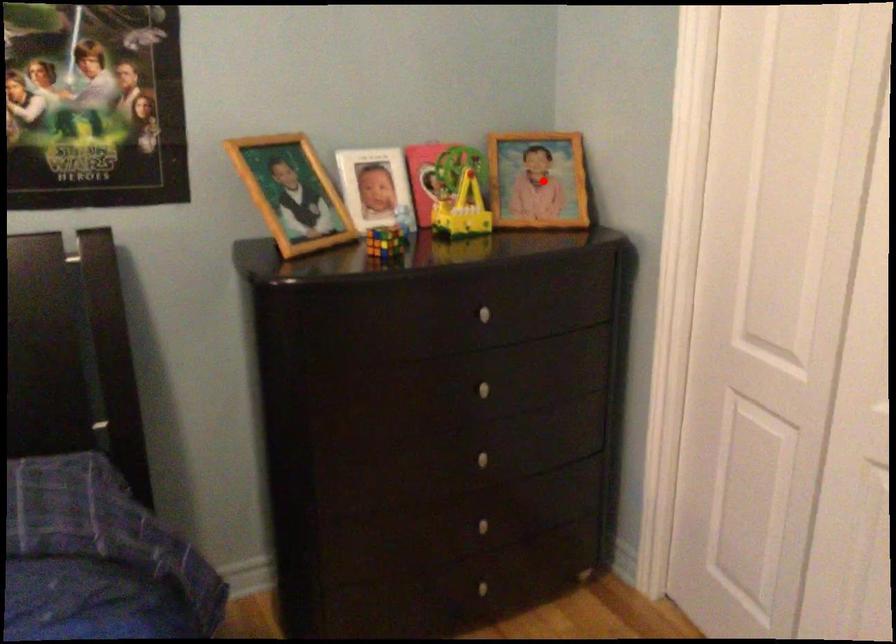
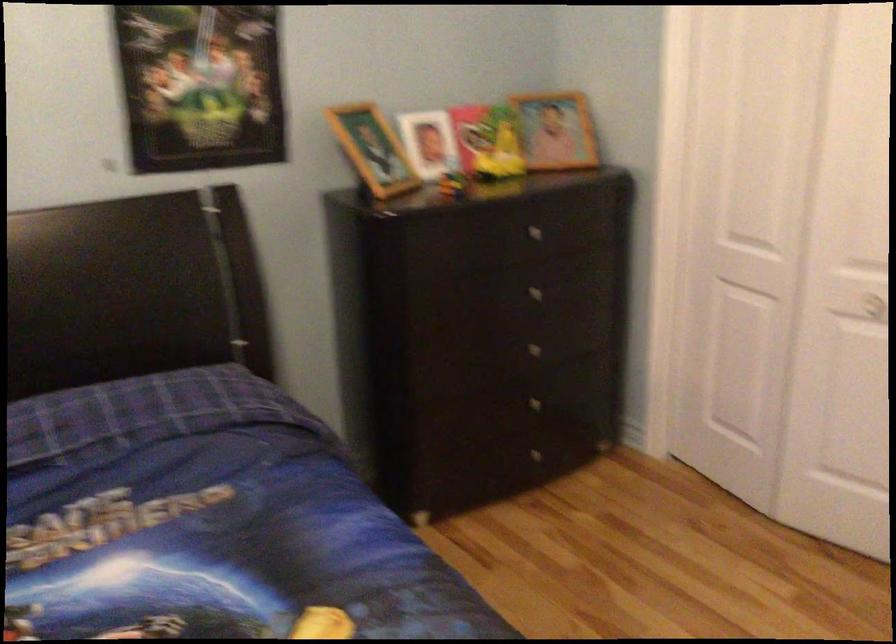
In the second image, find the point that corresponds to the highlighted location in the first image.

(556, 129)